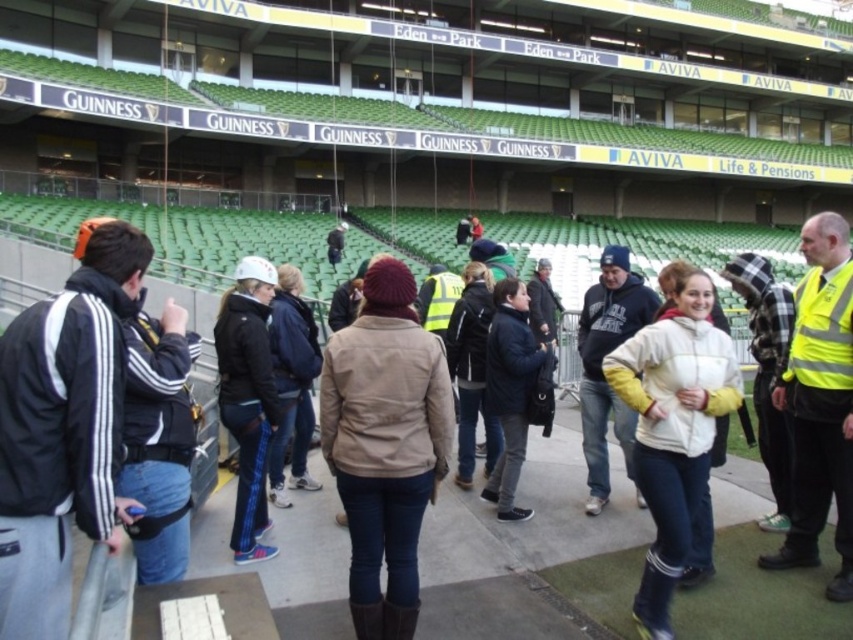
You are a photographer standing at the back of the group and want to take a photo of both the white fleece jacket at center and the matte black jacket at center. Which jacket will appear larger in the photo?

The white fleece jacket at center will appear larger in the photo because it is much taller than the matte black jacket at center.

You are standing at the back of the stadium and want to locate the beige fabric jacket at center and the white fleece jacket at center. Which one is higher up in the image?

The beige fabric jacket at center is above the white fleece jacket at center, so it is higher up in the image.